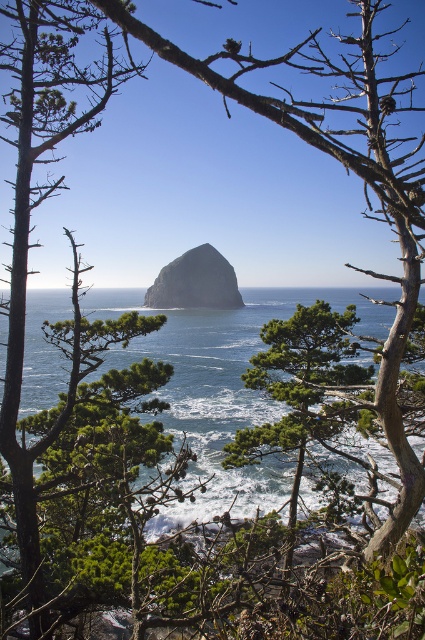
Is blue water at center wider than gray/rocky haystack rock at center?

Yes.

The height and width of the screenshot is (640, 425). I want to click on blue water at center, so click(x=221, y=380).

Describe the element at coordinates (221, 380) in the screenshot. This screenshot has width=425, height=640. I see `blue water at center` at that location.

Locate an element on the screen. The image size is (425, 640). blue water at center is located at coordinates (221, 380).